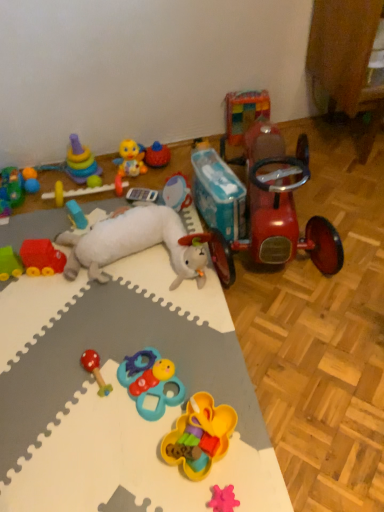
Locate an element on the screen. The height and width of the screenshot is (512, 384). vacant point to the right of matte blue car at center-left, the 11th toy positioned from the right is located at coordinates (109, 211).